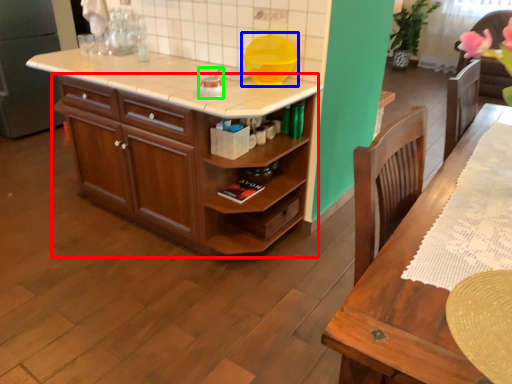
Question: Which object is the farthest from cabinetry (highlighted by a red box)? Choose among these: appliance (highlighted by a blue box) or appliance (highlighted by a green box).

Choices:
 (A) appliance
 (B) appliance

Answer: (A)